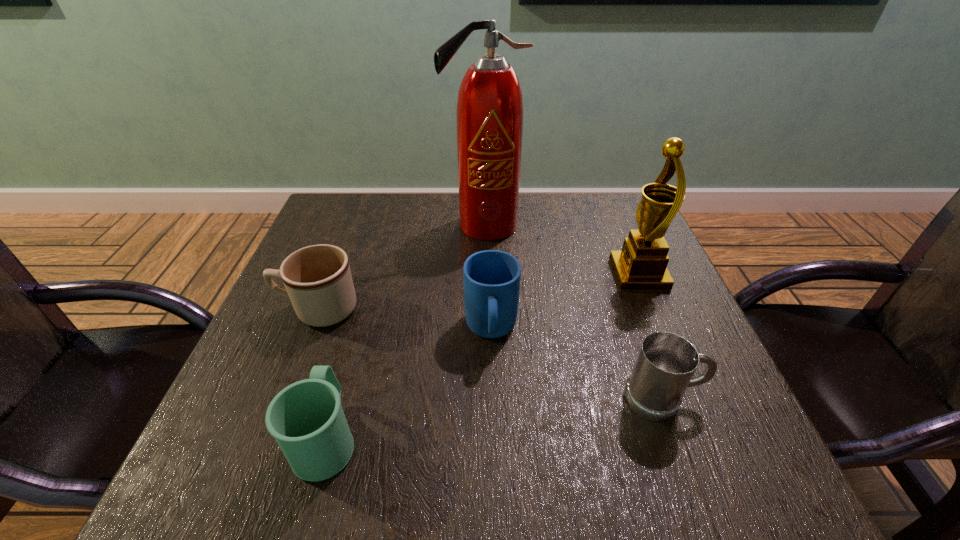
I want to click on the farthest object, so click(489, 117).

Image resolution: width=960 pixels, height=540 pixels. In order to click on fire extinguisher in this screenshot , I will do point(489,117).

Image resolution: width=960 pixels, height=540 pixels. I want to click on award, so click(642, 264).

Find the location of a particular element. The width and height of the screenshot is (960, 540). the second mug from right to left is located at coordinates (491, 278).

Locate an element on the screen. The image size is (960, 540). the rightmost mug is located at coordinates (666, 362).

The width and height of the screenshot is (960, 540). What are the coordinates of `free spot located 0.380m on the front of the tallest object` in the screenshot? It's located at (485, 359).

The width and height of the screenshot is (960, 540). Identify the location of blank area located 0.250m on the front-facing side of the award. (508, 274).

The width and height of the screenshot is (960, 540). In order to click on vacant point located 0.360m on the front-facing side of the award in this screenshot , I will do `click(461, 274)`.

Where is `vacant area located 0.390m on the front-facing side of the award`? This screenshot has height=540, width=960. vacant area located 0.390m on the front-facing side of the award is located at coordinates (448, 274).

At what (x,y) coordinates should I click in order to perform the action: click on vacant region located 0.240m on the side of the third mug from left to right with the handle. Please return your answer as a coordinate pair (x, y). The image size is (960, 540). Looking at the image, I should click on (495, 488).